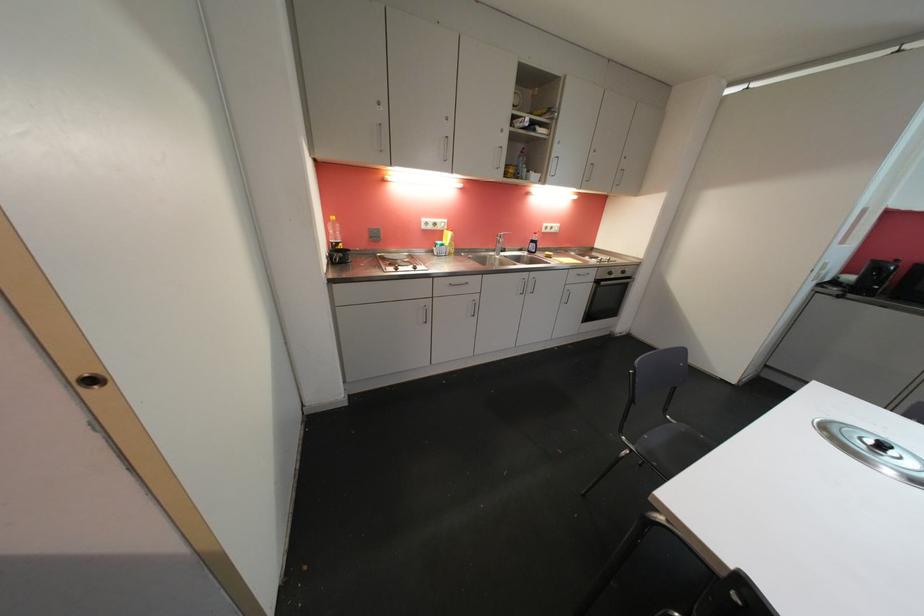
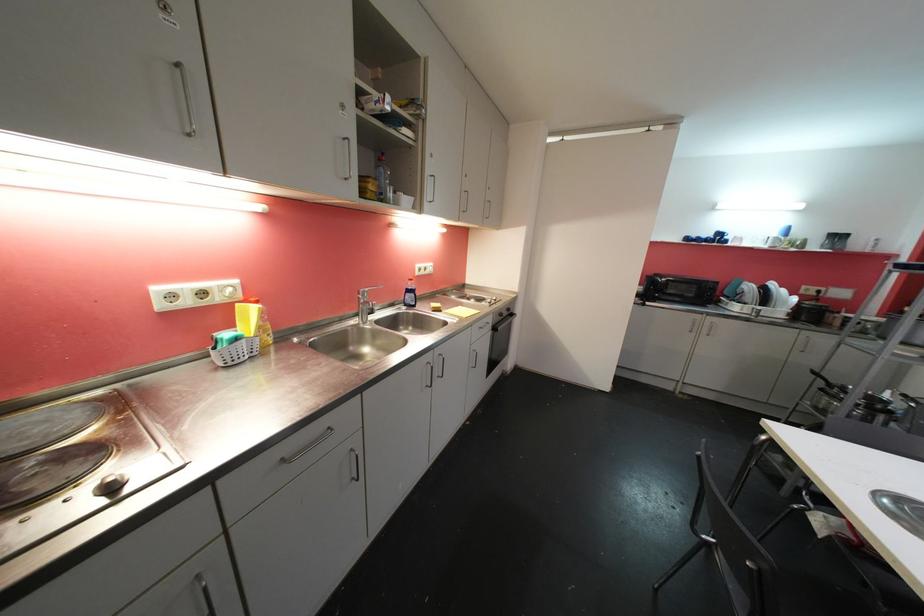
Locate, in the second image, the point that corresponds to (505,249) in the first image.

(370, 310)